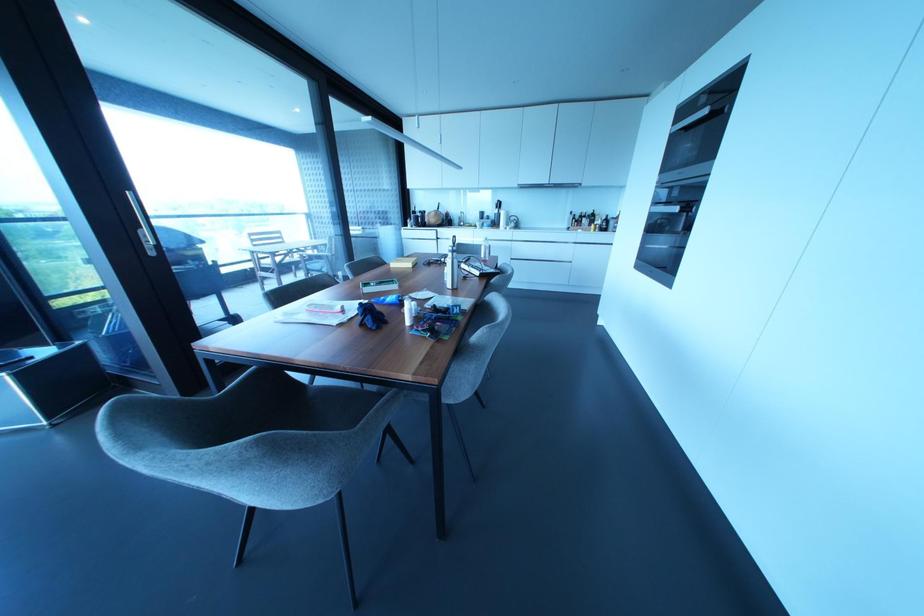
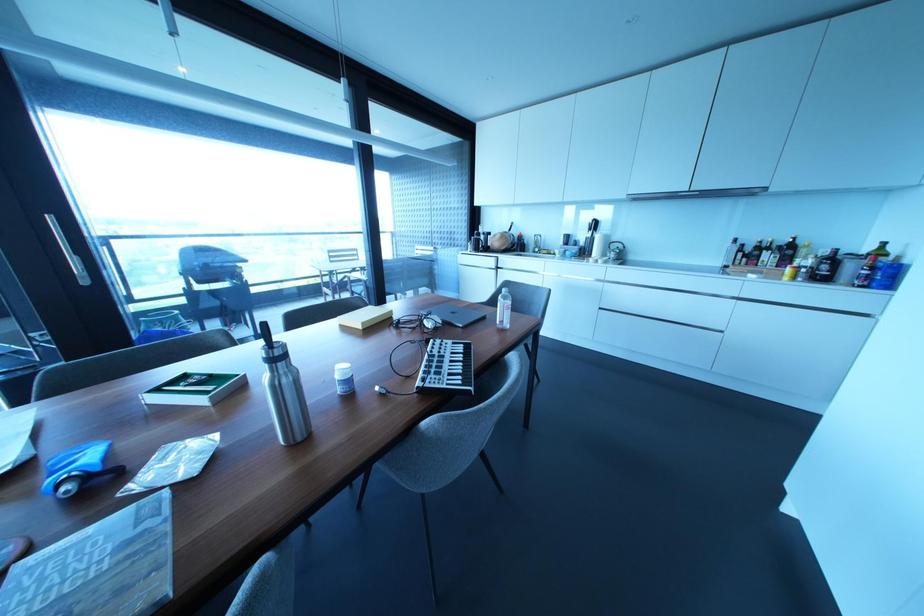
Locate, in the second image, the point that corresponds to pixel 477 272 in the first image.

(418, 382)